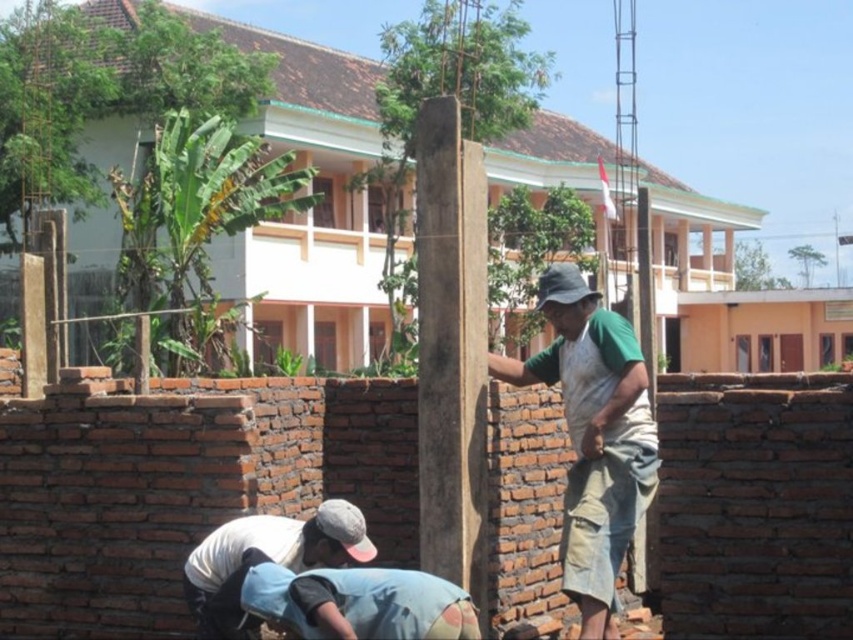
In the scene shown: You are standing at the entrance of the building and want to place a new flagpole exactly where the denim cap at lower center is currently located. According to the scene description, is this possible?

The denim cap at lower center is located at point (x=265, y=561). Since the flagpole is already near the building entrance, placing another flagpole at the denim cap position might not be feasible due to existing structures or space constraints, but the exact answer depends on the coordinates provided. However, the scene does not mention any obstacles at that specific coordinate, so theoretically, it could be possible.

You are a safety inspector standing in front of the construction site. You need to check the safety gear of the workers. Which object, the green fabric apron at center or the denim cap at lower center, is closer to you?

The green fabric apron at center is closer to you because it is further to the viewer than the denim cap at lower center.